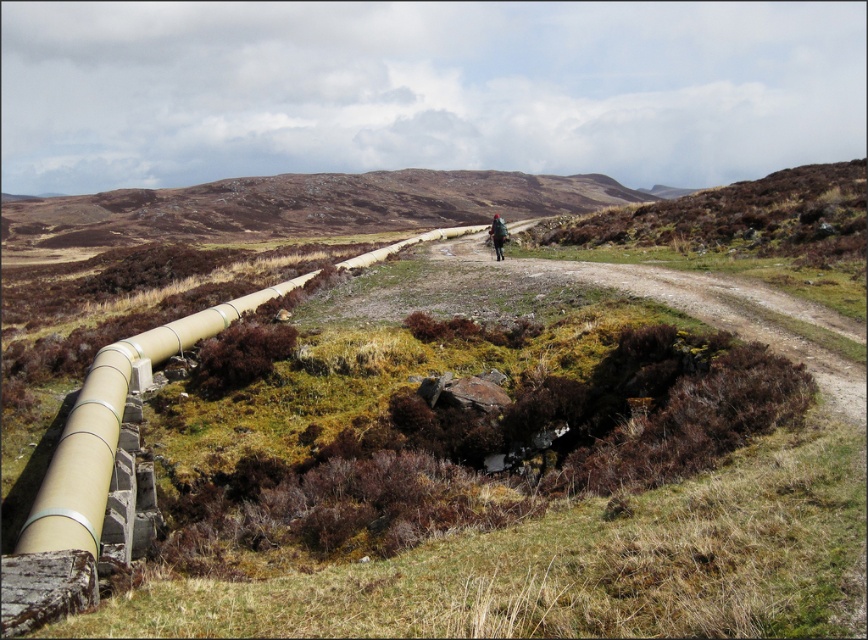
The height and width of the screenshot is (640, 868). Describe the element at coordinates (301, 205) in the screenshot. I see `brown grassy hillside at center` at that location.

This screenshot has width=868, height=640. In order to click on brown grassy hillside at center in this screenshot , I will do `click(301, 205)`.

In the scene shown: Who is more forward, (536, 200) or (494, 244)?

Point (494, 244)

Find the location of a particular element. brown grassy hillside at center is located at coordinates (301, 205).